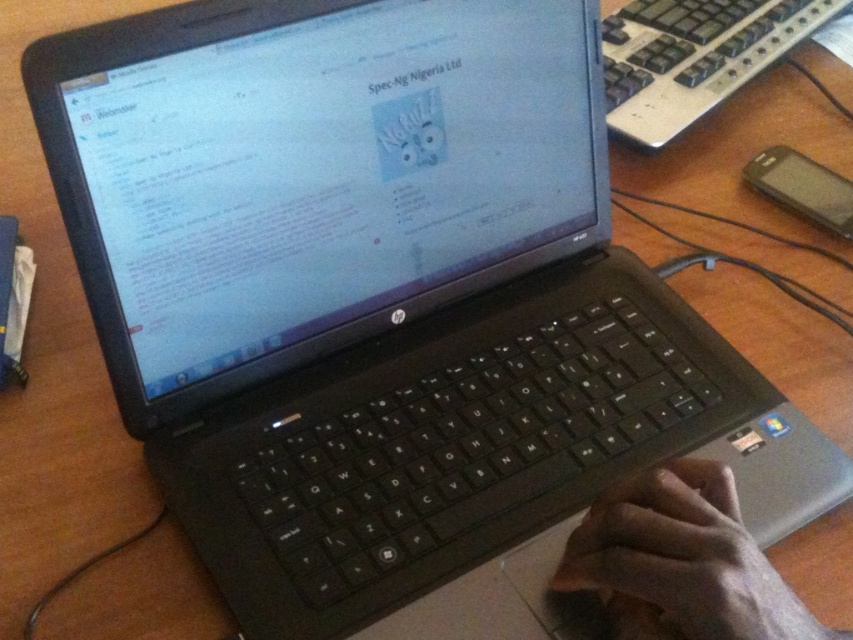
Question: Is skinny white hand at lower right smaller than black plastic keyboard at upper right?

Choices:
 (A) yes
 (B) no

Answer: (A)

Question: Which object appears farthest from the camera in this image?

Choices:
 (A) skinny white hand at lower right
 (B) black plastic keyboard at upper right

Answer: (B)

Question: Does skinny white hand at lower right have a smaller size compared to black plastic keyboard at upper right?

Choices:
 (A) yes
 (B) no

Answer: (A)

Question: Which point is closer to the camera?

Choices:
 (A) (611, 26)
 (B) (741, 627)

Answer: (B)

Question: Observing the image, what is the correct spatial positioning of skinny white hand at lower right in reference to black plastic keyboard at upper right?

Choices:
 (A) right
 (B) left

Answer: (B)

Question: Which object appears closest to the camera in this image?

Choices:
 (A) skinny white hand at lower right
 (B) black plastic keyboard at upper right

Answer: (A)